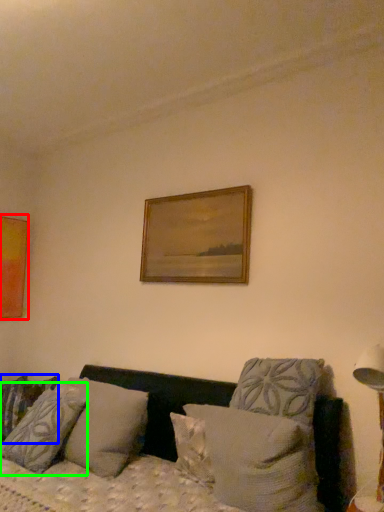
Question: Estimate the real-world distances between objects in this image. Which object is farther from picture frame (highlighted by a red box), pillow (highlighted by a blue box) or pillow (highlighted by a green box)?

Choices:
 (A) pillow
 (B) pillow

Answer: (B)